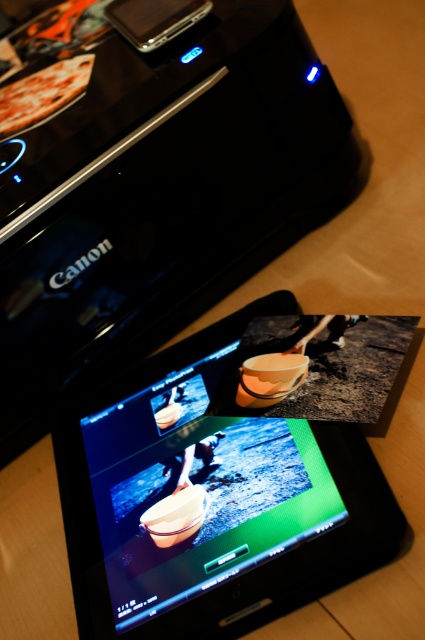
You are using the tablet to edit a photo. There are two points on the photo displayed on the tablet screen. The first point is at coordinate point (354, 524) and the second point is at coordinate point (68, 88). Which point is closer to you on the tablet screen?

Point (354, 524) is closer to the viewer than point (68, 88).

You are holding a pen and want to draw a line from the point at point [133,572] to the center of the tablet screen. How long should the line be in centimeters?

The points are 76.63 centimeters apart, so the line should be 76.63 centimeters long.

In the scene shown: You are trying to locate the golden pizza at upper left in the image. Where should you look relative to the black glossy tablet at center?

The golden pizza at upper left is above the black glossy tablet at center.